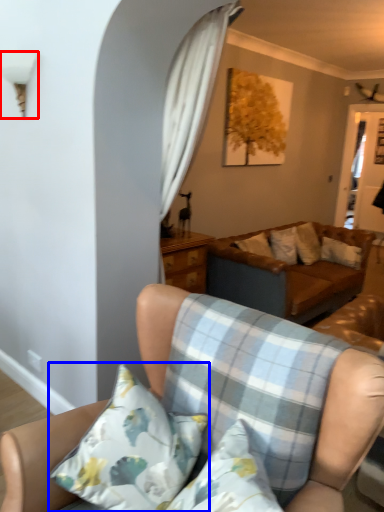
Question: Which of the following is the farthest to the observer, lamp (highlighted by a red box) or pillow (highlighted by a blue box)?

Choices:
 (A) lamp
 (B) pillow

Answer: (A)